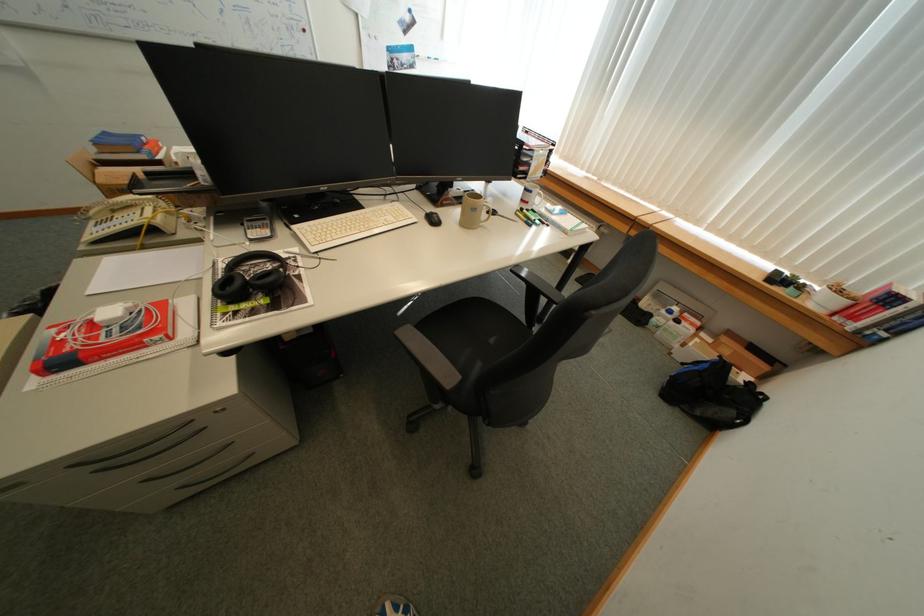
Find where to open the black backpack. Please return your answer as a coordinate pair (x, y).

(711, 395)